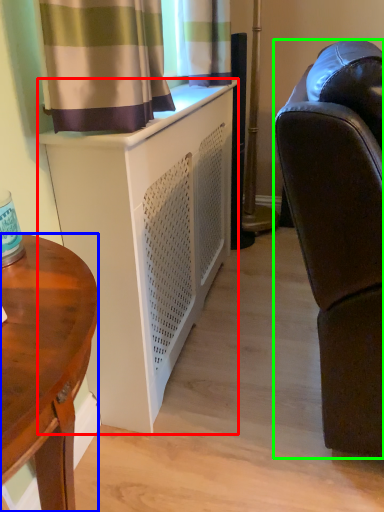
Question: Based on their relative distances, which object is farther from cabinetry (highlighted by a red box)? Choose from desk (highlighted by a blue box) and studio couch (highlighted by a green box).

Choices:
 (A) desk
 (B) studio couch

Answer: (A)